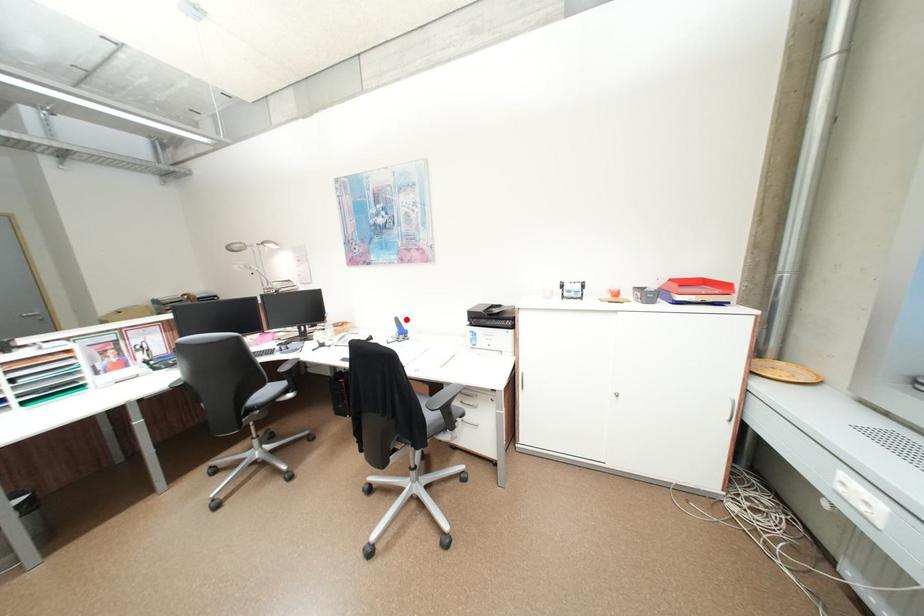
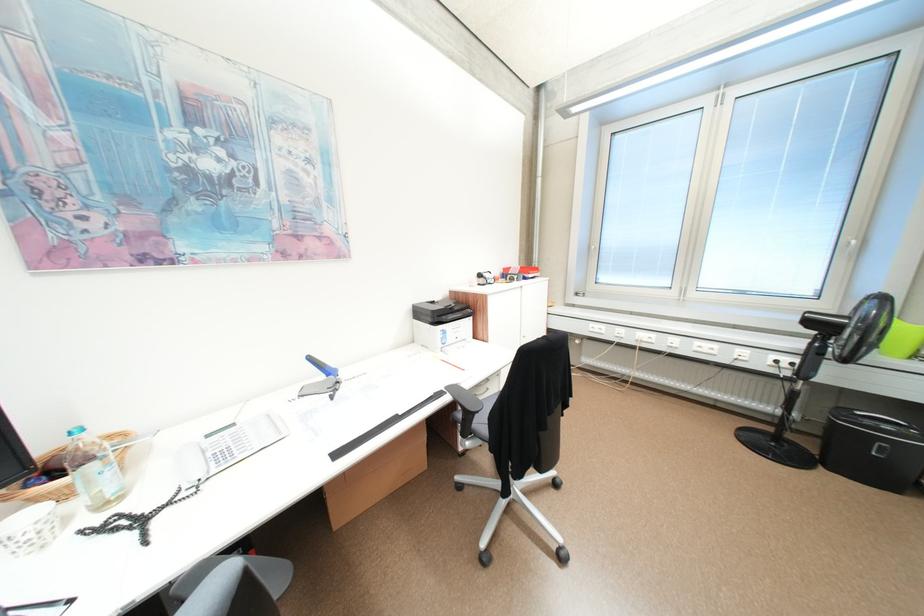
Where in the second image is the point corresponding to the highlighted location from the first image?

(320, 359)